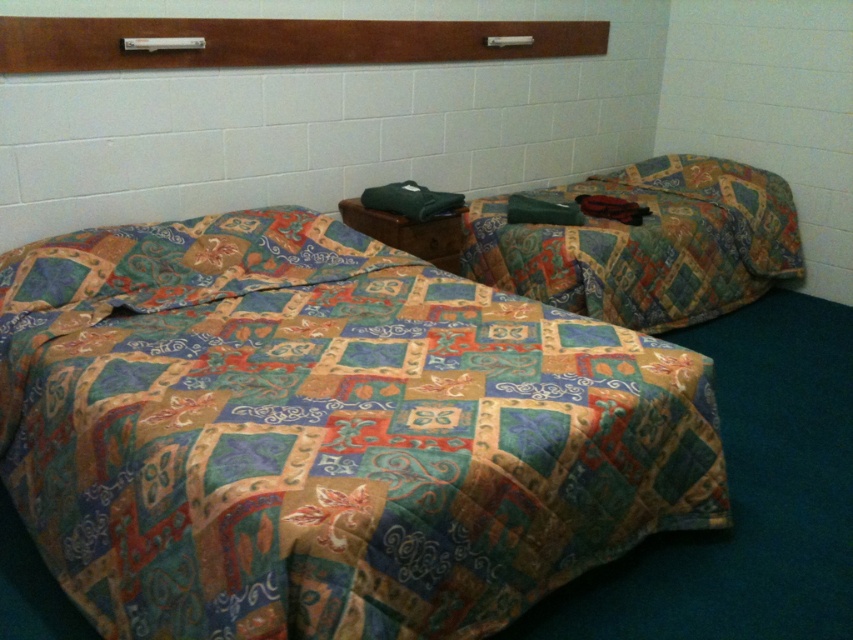
Question: Which object is farther from the camera taking this photo?

Choices:
 (A) patterned fabric bed at right
 (B) patchwork quilt at center

Answer: (A)

Question: Is patchwork quilt at center below patterned fabric bed at right?

Choices:
 (A) yes
 (B) no

Answer: (A)

Question: Observing the image, what is the correct spatial positioning of patchwork quilt at center in reference to patterned fabric bed at right?

Choices:
 (A) right
 (B) left

Answer: (B)

Question: Does patchwork quilt at center have a greater width compared to patterned fabric bed at right?

Choices:
 (A) yes
 (B) no

Answer: (A)

Question: Which object is farther from the camera taking this photo?

Choices:
 (A) patchwork quilt at center
 (B) patterned fabric bed at right

Answer: (B)

Question: Which of the following is the farthest from the observer?

Choices:
 (A) (604, 300)
 (B) (279, 480)

Answer: (A)